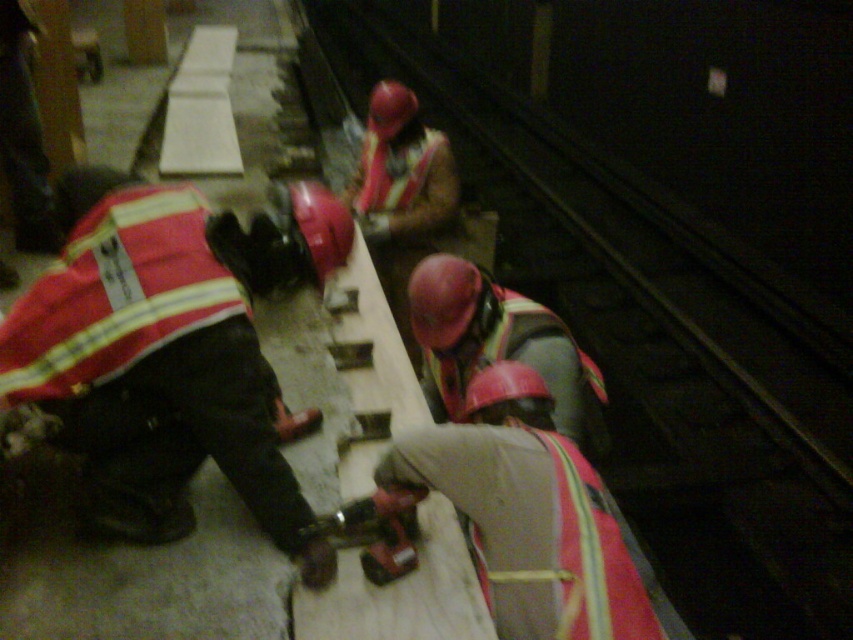
Based on the coordinates provided, where is the reflective safety vest at lower left positioned in the image?

The reflective safety vest at lower left is positioned at coordinates point [169,349].

You are a safety inspector standing at the camera position. You need to check the condition of the red hard hat at center. Can you reach it without moving from your current position if your arm can extend 5 feet?

The red hard hat at center is 5.16 feet away from the camera. Since your arm can only extend 5 feet, you cannot reach it without moving from your current position.